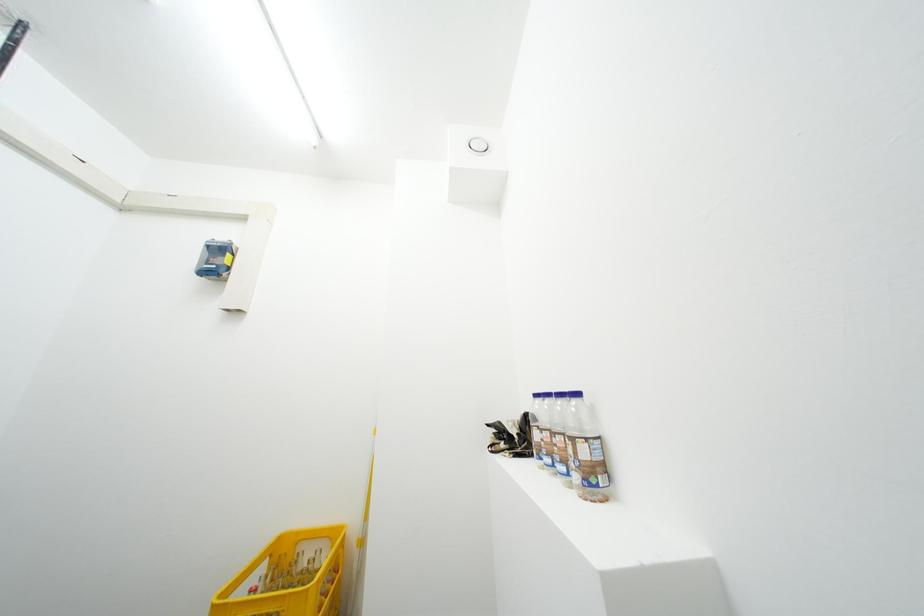
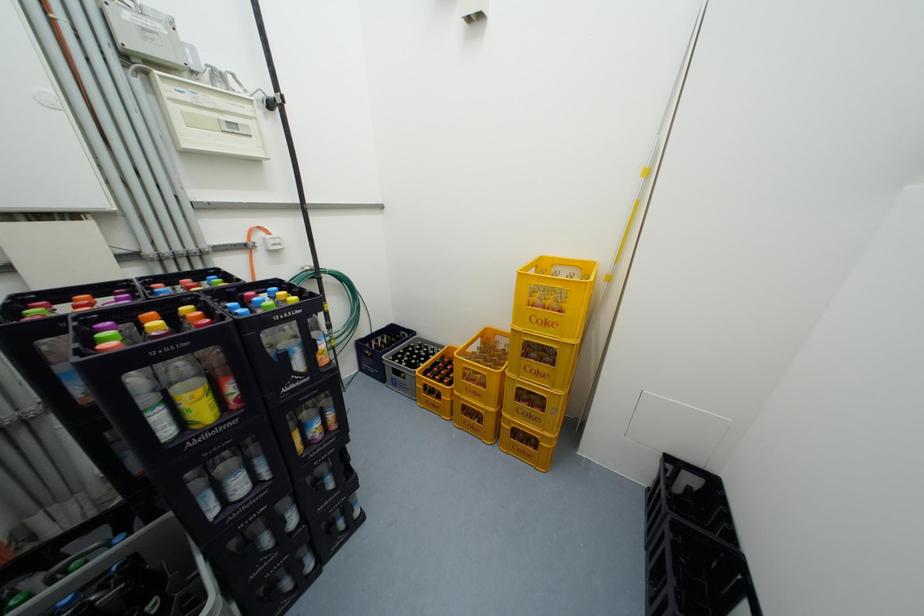
First-person continuous shooting, in which direction is the camera rotating?

The rotation direction of the camera is left-down.